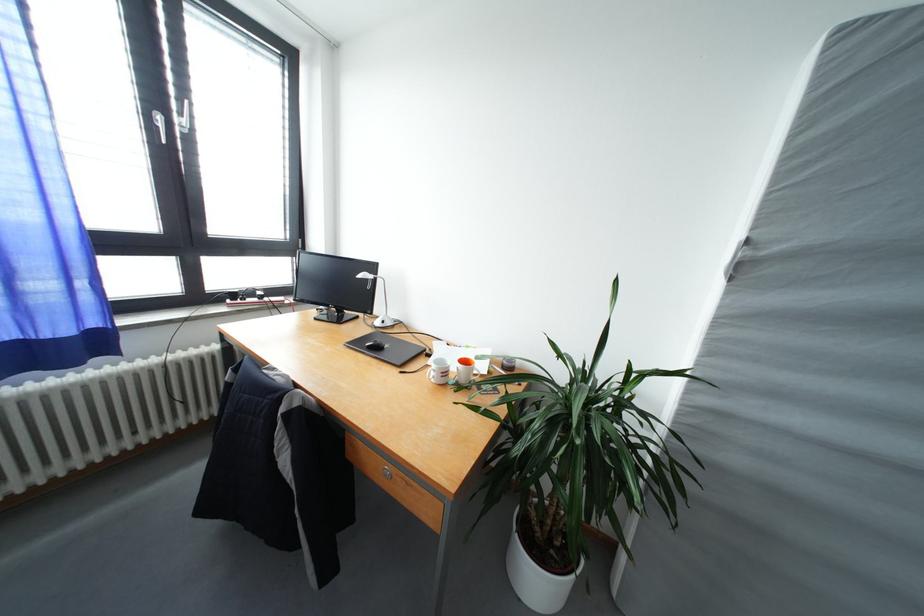
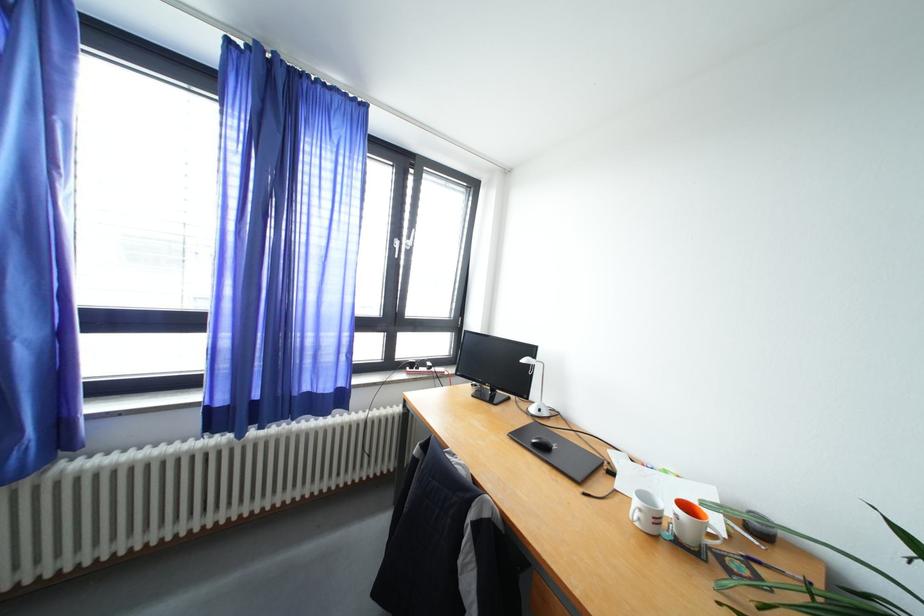
The point at (440, 379) is marked in the first image. Where is the corresponding point in the second image?

(645, 519)